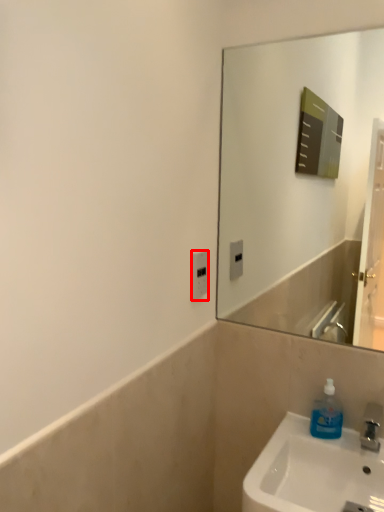
Question: From the image's perspective, where is electric outlet (annotated by the red box) located relative to soap dispenser?

Choices:
 (A) below
 (B) above

Answer: (B)